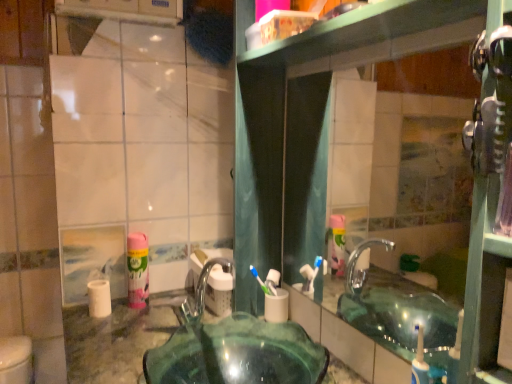
This screenshot has width=512, height=384. I want to click on transparent glass sink at center, so click(x=234, y=349).

The image size is (512, 384). What do you see at coordinates (137, 270) in the screenshot?
I see `pink matte mouthwash at left` at bounding box center [137, 270].

What is the approximate height of clear glass mirror at upper center?

23.87 inches.

Where is `transparent glass sink at center`? transparent glass sink at center is located at coordinates (234, 349).

From a real-world perspective, is clear glass mirror at upper center above or below pink matte mouthwash at left?

clear glass mirror at upper center is above pink matte mouthwash at left.

From the image's perspective, which one is positioned higher, clear glass mirror at upper center or pink matte mouthwash at left?

clear glass mirror at upper center appears higher in the image.

Between clear glass mirror at upper center and pink matte mouthwash at left, which one has smaller size?

pink matte mouthwash at left is smaller.

Is pink matte mouthwash at left not near white matte toilet paper at center, which appears as the 2th toilet paper when viewed from the left?

No, pink matte mouthwash at left is in close proximity to white matte toilet paper at center, which appears as the 2th toilet paper when viewed from the left.

Considering the positions of objects pink matte mouthwash at left and white matte toilet paper at center, which appears as the 2th toilet paper when viewed from the left, in the image provided, who is behind, pink matte mouthwash at left or white matte toilet paper at center, which appears as the 2th toilet paper when viewed from the left,?

pink matte mouthwash at left is further from the camera.

Which of these two, pink matte mouthwash at left or white matte toilet paper at center, which appears as the 2th toilet paper when viewed from the left, stands shorter?

white matte toilet paper at center, which appears as the 2th toilet paper when viewed from the left, is shorter.

From the image's perspective, is pink matte mouthwash at left on top of white matte toilet paper at center, which appears as the 2th toilet paper when viewed from the left?

Correct, pink matte mouthwash at left appears higher than white matte toilet paper at center, which appears as the 2th toilet paper when viewed from the left, in the image.

Can you confirm if white matte toilet paper at left, which is the second toilet paper from right to left, is thinner than clear glass mirror at upper center?

In fact, white matte toilet paper at left, which is the second toilet paper from right to left, might be wider than clear glass mirror at upper center.

Is white matte toilet paper at left, which is the second toilet paper from right to left, bigger or smaller than clear glass mirror at upper center?

white matte toilet paper at left, which is the second toilet paper from right to left, is smaller than clear glass mirror at upper center.

From the image's perspective, is white matte toilet paper at left, which is the second toilet paper from right to left, beneath clear glass mirror at upper center?

Correct, white matte toilet paper at left, which is the second toilet paper from right to left, appears lower than clear glass mirror at upper center in the image.

Is white matte toilet paper at left, which is the second toilet paper from right to left, positioned beyond the bounds of clear glass mirror at upper center?

Indeed, white matte toilet paper at left, which is the second toilet paper from right to left, is completely outside clear glass mirror at upper center.

From the picture: In terms of size, does transparent glass sink at center appear bigger or smaller than white matte toilet paper at center, which appears as the 2th toilet paper when viewed from the left?

Clearly, transparent glass sink at center is larger in size than white matte toilet paper at center, which appears as the 2th toilet paper when viewed from the left.

Looking at this image, from the image's perspective, which is above, transparent glass sink at center or white matte toilet paper at center, placed as the first toilet paper when sorted from right to left?

white matte toilet paper at center, placed as the first toilet paper when sorted from right to left, appears higher in the image.

Can you confirm if transparent glass sink at center is positioned to the right of white matte toilet paper at center, which appears as the 2th toilet paper when viewed from the left?

No.

From a real-world perspective, is transparent glass sink at center under pink matte mouthwash at left?

Yes, from a real-world perspective, transparent glass sink at center is beneath pink matte mouthwash at left.

Which object is more forward, transparent glass sink at center or pink matte mouthwash at left?

transparent glass sink at center is more forward.

Which is further, (224, 323) or (146, 268)?

Positioned behind is point (146, 268).

Considering the sizes of pink matte mouthwash at left and clear glass mirror at upper center in the image, is pink matte mouthwash at left wider or thinner than clear glass mirror at upper center?

Considering their sizes, pink matte mouthwash at left looks broader than clear glass mirror at upper center.

From a real-world perspective, who is located higher, pink matte mouthwash at left or clear glass mirror at upper center?

clear glass mirror at upper center, from a real-world perspective.

Between pink matte mouthwash at left and clear glass mirror at upper center, which one appears on the left side from the viewer's perspective?

Positioned to the left is pink matte mouthwash at left.

How many degrees apart are the facing directions of pink matte mouthwash at left and clear glass mirror at upper center?

pink matte mouthwash at left and clear glass mirror at upper center are facing 0.618 degrees away from each other.

Considering the sizes of transparent glass sink at center and white matte toilet paper at left, which is the second toilet paper from right to left, in the image, is transparent glass sink at center wider or thinner than white matte toilet paper at left, which is the second toilet paper from right to left,?

transparent glass sink at center is wider than white matte toilet paper at left, which is the second toilet paper from right to left.

From a real-world perspective, does transparent glass sink at center sit lower than white matte toilet paper at left, which ranks as the 1th toilet paper in left-to-right order?

Yes, from a real-world perspective, transparent glass sink at center is under white matte toilet paper at left, which ranks as the 1th toilet paper in left-to-right order.

Image resolution: width=512 pixels, height=384 pixels. In order to click on sink on the right of white matte toilet paper at left, which is the second toilet paper from right to left in this screenshot , I will do `click(234, 349)`.

Who is shorter, transparent glass sink at center or white matte toilet paper at left, which ranks as the 1th toilet paper in left-to-right order?

Standing shorter between the two is white matte toilet paper at left, which ranks as the 1th toilet paper in left-to-right order.

This screenshot has height=384, width=512. Identify the location of mouthwash below the clear glass mirror at upper center (from the image's perspective). (137, 270).

The width and height of the screenshot is (512, 384). Identify the location of toilet paper on the right of pink matte mouthwash at left. (277, 306).

When comparing their distances from clear glass mirror at upper center, does pink matte mouthwash at left or white matte toilet paper at center, placed as the first toilet paper when sorted from right to left, seem further?

pink matte mouthwash at left.

Which object lies nearer to the anchor point clear glass mirror at upper center, transparent glass sink at center or white matte toilet paper at left, which is the second toilet paper from right to left?

Among the two, transparent glass sink at center is located nearer to clear glass mirror at upper center.

When comparing their distances from pink matte mouthwash at left, does white matte toilet paper at left, which is the second toilet paper from right to left, or white matte toilet paper at center, which appears as the 2th toilet paper when viewed from the left, seem further?

The object further to pink matte mouthwash at left is white matte toilet paper at center, which appears as the 2th toilet paper when viewed from the left.

Considering their positions, is transparent glass sink at center positioned further to white matte toilet paper at left, which ranks as the 1th toilet paper in left-to-right order, than white matte toilet paper at center, placed as the first toilet paper when sorted from right to left?

The object further to white matte toilet paper at left, which ranks as the 1th toilet paper in left-to-right order, is white matte toilet paper at center, placed as the first toilet paper when sorted from right to left.

From the image, which object appears to be farther from white matte toilet paper at left, which ranks as the 1th toilet paper in left-to-right order, white matte toilet paper at center, which appears as the 2th toilet paper when viewed from the left, or transparent glass sink at center?

white matte toilet paper at center, which appears as the 2th toilet paper when viewed from the left, lies further to white matte toilet paper at left, which ranks as the 1th toilet paper in left-to-right order, than the other object.

From the image, which object appears to be nearer to white matte toilet paper at center, placed as the first toilet paper when sorted from right to left, pink matte mouthwash at left or transparent glass sink at center?

transparent glass sink at center is positioned closer to the anchor white matte toilet paper at center, placed as the first toilet paper when sorted from right to left.

From the image, which object appears to be nearer to white matte toilet paper at left, which ranks as the 1th toilet paper in left-to-right order, pink matte mouthwash at left or white matte toilet paper at center, placed as the first toilet paper when sorted from right to left?

Based on the image, pink matte mouthwash at left appears to be nearer to white matte toilet paper at left, which ranks as the 1th toilet paper in left-to-right order.

Estimate the real-world distances between objects in this image. Which object is closer to white matte toilet paper at left, which is the second toilet paper from right to left, white matte toilet paper at center, which appears as the 2th toilet paper when viewed from the left, or pink matte mouthwash at left?

pink matte mouthwash at left is positioned closer to the anchor white matte toilet paper at left, which is the second toilet paper from right to left.

You are a GUI agent. You are given a task and a screenshot of the screen. Output one action in this format:
    pyautogui.click(x=<x>, y=<y>)
    Task: Click on the sink located between clear glass mirror at upper center and white matte toilet paper at center, which appears as the 2th toilet paper when viewed from the left, in the depth direction
    This screenshot has width=512, height=384.
    Given the screenshot: What is the action you would take?
    pyautogui.click(x=234, y=349)

Find the location of a particular element. sink between white matte toilet paper at left, which ranks as the 1th toilet paper in left-to-right order, and clear glass mirror at upper center, in the horizontal direction is located at coordinates (234, 349).

At what (x,y) coordinates should I click in order to perform the action: click on toilet paper located between transparent glass sink at center and white matte toilet paper at left, which ranks as the 1th toilet paper in left-to-right order, in the depth direction. Please return your answer as a coordinate pair (x, y). Looking at the image, I should click on (277, 306).

This screenshot has width=512, height=384. What are the coordinates of `toilet paper between white matte toilet paper at left, which is the second toilet paper from right to left, and clear glass mirror at upper center from left to right` in the screenshot? It's located at (277, 306).